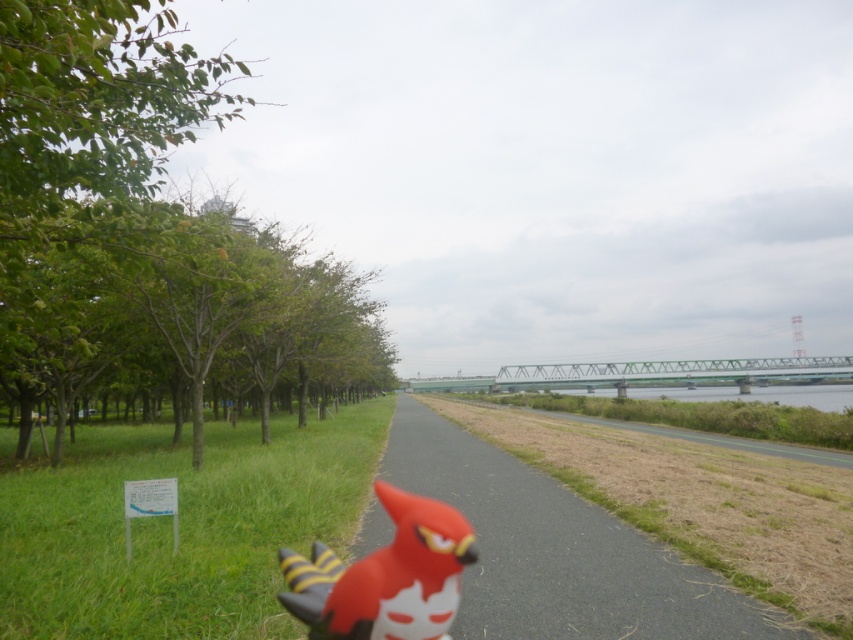
Between green grass at left and rubber duck at center, which one is positioned higher?

Positioned higher is rubber duck at center.

Which is behind, point (97, 545) or point (730, 588)?

Positioned behind is point (97, 545).

Find the location of `green grass at left`. green grass at left is located at coordinates 178,528.

Between green grass at left and rubberized red bird at center, which one has more height?

green grass at left

Between green grass at left and rubberized red bird at center, which one is positioned higher?

rubberized red bird at center is above.

Which is in front, point (22, 611) or point (300, 618)?

Point (300, 618) is in front.

You are a GUI agent. You are given a task and a screenshot of the screen. Output one action in this format:
    pyautogui.click(x=<x>, y=<y>)
    Task: Click on the green grass at left
    
    Given the screenshot: What is the action you would take?
    pyautogui.click(x=178, y=528)

Between green leafy trees at left and rubberized red bird at center, which one is positioned higher?

green leafy trees at left is above.

Does green leafy trees at left have a greater width compared to rubberized red bird at center?

Indeed, green leafy trees at left has a greater width compared to rubberized red bird at center.

You are a GUI agent. You are given a task and a screenshot of the screen. Output one action in this format:
    pyautogui.click(x=<x>, y=<y>)
    Task: Click on the green leafy trees at left
    The image size is (853, 640).
    Given the screenshot: What is the action you would take?
    pyautogui.click(x=183, y=321)